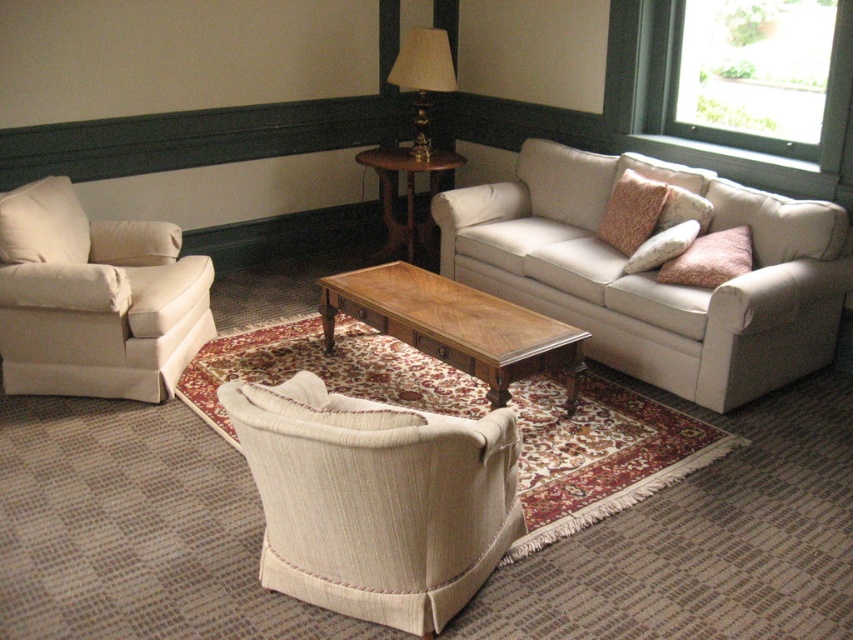
The height and width of the screenshot is (640, 853). In order to click on beige fabric couch at center in this screenshot , I will do `click(653, 275)`.

Can you confirm if beige fabric couch at center is bigger than velvet pink pillow at center right?

Correct, beige fabric couch at center is larger in size than velvet pink pillow at center right.

Locate an element on the screen. beige fabric couch at center is located at coordinates (653, 275).

Does beige fabric couch at center have a lesser width compared to beige fabric armchair at center?

No, beige fabric couch at center is not thinner than beige fabric armchair at center.

The height and width of the screenshot is (640, 853). What do you see at coordinates (653, 275) in the screenshot? I see `beige fabric couch at center` at bounding box center [653, 275].

Between point (804, 349) and point (312, 492), which one is positioned behind?

Point (804, 349)

Identify the location of beige fabric couch at center. The height and width of the screenshot is (640, 853). (653, 275).

Consider the image. Which is more to the right, beige fabric armchair at left or mahogany wood side table at center?

Positioned to the right is mahogany wood side table at center.

Who is shorter, beige fabric armchair at left or mahogany wood side table at center?

Standing shorter between the two is mahogany wood side table at center.

Where is `beige fabric armchair at left`? This screenshot has height=640, width=853. beige fabric armchair at left is located at coordinates (94, 300).

Where is `beige fabric armchair at left`? The image size is (853, 640). beige fabric armchair at left is located at coordinates (94, 300).